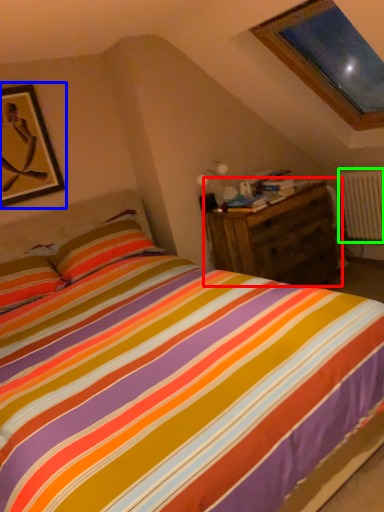
Question: Which is farther away from nightstand (highlighted by a red box)? picture frame (highlighted by a blue box) or radiator (highlighted by a green box)?

Choices:
 (A) picture frame
 (B) radiator

Answer: (A)